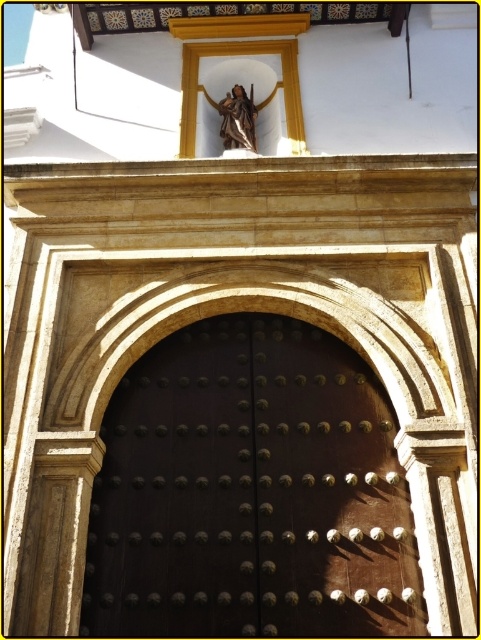
Question: Does dark polished wood door at center appear on the left side of matte bronze statue at upper center?

Choices:
 (A) yes
 (B) no

Answer: (B)

Question: In this image, where is dark polished wood door at center located relative to matte bronze statue at upper center?

Choices:
 (A) left
 (B) right

Answer: (B)

Question: Can you confirm if dark polished wood door at center is positioned to the left of matte bronze statue at upper center?

Choices:
 (A) yes
 (B) no

Answer: (B)

Question: Which of the following is the closest to the observer?

Choices:
 (A) (210, 385)
 (B) (222, 113)

Answer: (A)

Question: Which object is closer to the camera taking this photo?

Choices:
 (A) dark polished wood door at center
 (B) matte bronze statue at upper center

Answer: (A)

Question: Which point is closer to the camera?

Choices:
 (A) matte bronze statue at upper center
 (B) dark polished wood door at center

Answer: (B)